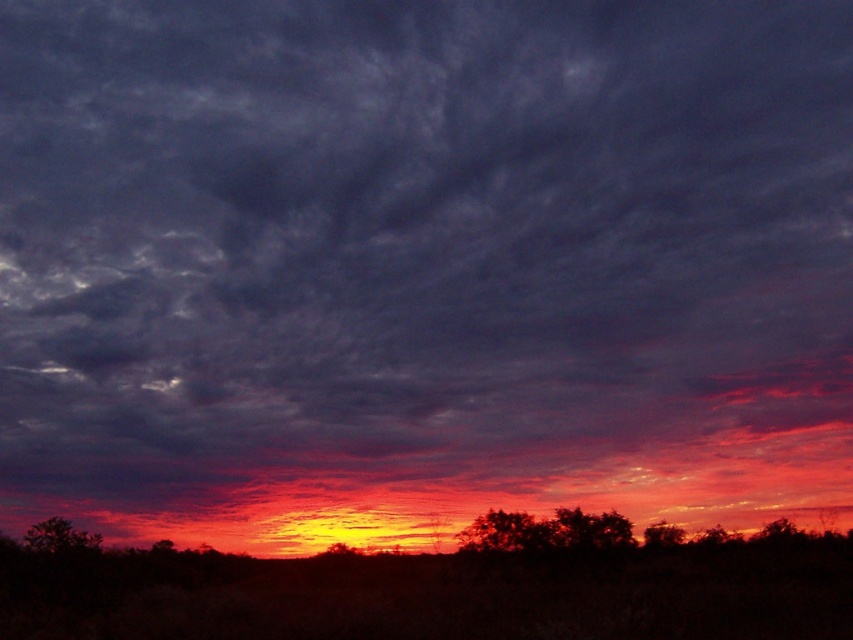
Question: Is silhouetted tree at lower center above silhouetted tree at lower left?

Choices:
 (A) no
 (B) yes

Answer: (A)

Question: Observing the image, what is the correct spatial positioning of silhouetted tree at lower left in reference to silhouette tree at lower right?

Choices:
 (A) right
 (B) left

Answer: (B)

Question: Considering the real-world distances, which object is farthest from the silhouetted tree at lower center?

Choices:
 (A) silhouette tree at lower right
 (B) silhouette tree at center
 (C) silhouetted tree at lower left

Answer: (C)

Question: Among these objects, which one is nearest to the camera?

Choices:
 (A) silhouetted tree at lower left
 (B) silhouette tree at center
 (C) silhouetted tree at lower center
 (D) silhouette tree at lower right

Answer: (A)

Question: Observing the image, what is the correct spatial positioning of silhouetted tree at lower center in reference to silhouetted tree at lower left?

Choices:
 (A) below
 (B) above

Answer: (A)

Question: Which is nearer to the silhouette tree at lower right?

Choices:
 (A) silhouetted tree at lower center
 (B) silhouetted tree at lower left

Answer: (A)